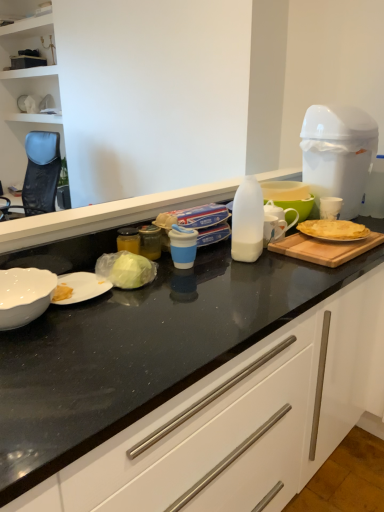
Question: Is wooden cutting board at right completely or partially inside white glossy bowl at lower left?

Choices:
 (A) yes
 (B) no

Answer: (B)

Question: Can you confirm if white glossy bowl at lower left is positioned to the right of wooden cutting board at right?

Choices:
 (A) yes
 (B) no

Answer: (B)

Question: Considering the relative positions of white glossy bowl at lower left and wooden cutting board at right in the image provided, is white glossy bowl at lower left to the left of wooden cutting board at right from the viewer's perspective?

Choices:
 (A) no
 (B) yes

Answer: (B)

Question: Is white glossy bowl at lower left looking in the opposite direction of wooden cutting board at right?

Choices:
 (A) no
 (B) yes

Answer: (A)

Question: Is white glossy bowl at lower left positioned before wooden cutting board at right?

Choices:
 (A) yes
 (B) no

Answer: (A)

Question: From a real-world perspective, does white glossy bowl at lower left sit lower than wooden cutting board at right?

Choices:
 (A) no
 (B) yes

Answer: (A)

Question: Considering the relative sizes of golden crispy crepe at right and white glossy countertop at center in the image provided, is golden crispy crepe at right wider than white glossy countertop at center?

Choices:
 (A) no
 (B) yes

Answer: (A)

Question: From a real-world perspective, is golden crispy crepe at right physically above white glossy countertop at center?

Choices:
 (A) no
 (B) yes

Answer: (B)

Question: Is golden crispy crepe at right not within white glossy countertop at center?

Choices:
 (A) no
 (B) yes

Answer: (A)

Question: Considering the relative sizes of golden crispy crepe at right and white glossy countertop at center in the image provided, is golden crispy crepe at right thinner than white glossy countertop at center?

Choices:
 (A) no
 (B) yes

Answer: (B)

Question: Is golden crispy crepe at right touching white glossy countertop at center?

Choices:
 (A) no
 (B) yes

Answer: (A)

Question: Is golden crispy crepe at right at the right side of white glossy countertop at center?

Choices:
 (A) yes
 (B) no

Answer: (A)

Question: Is translucent plastic milk bottle at center positioned in front of wooden cutting board at right?

Choices:
 (A) no
 (B) yes

Answer: (B)